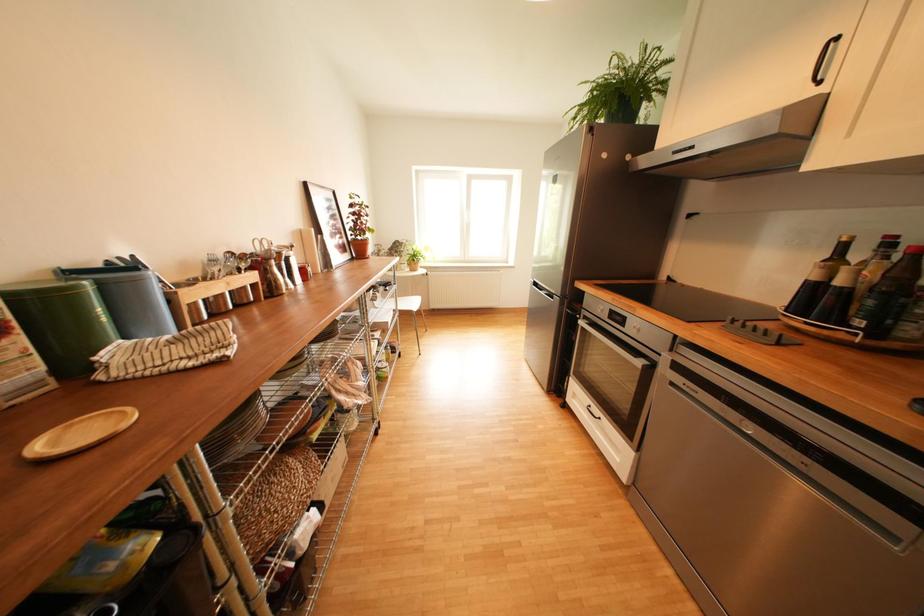
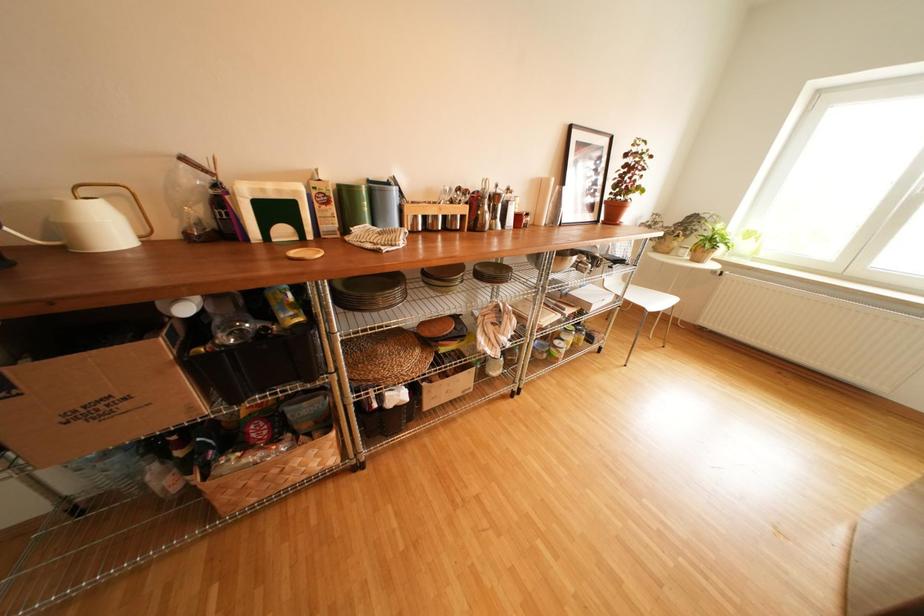
The images are taken continuously from a first-person perspective. In which direction is your viewpoint rotating?

The camera's rotation is toward left-down.